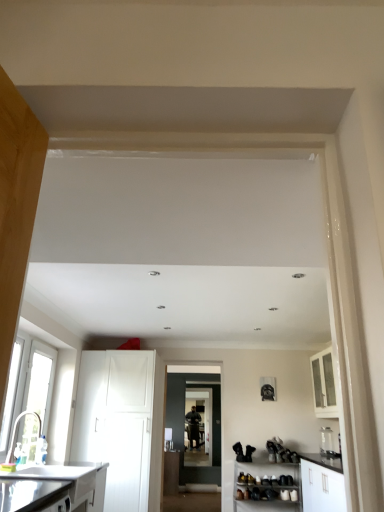
Question: Considering the positions of clear glass jar at lower right and transparent glass door at center in the image, is clear glass jar at lower right taller or shorter than transparent glass door at center?

Choices:
 (A) short
 (B) tall

Answer: (A)

Question: Considering the positions of clear glass jar at lower right and transparent glass door at center in the image, is clear glass jar at lower right wider or thinner than transparent glass door at center?

Choices:
 (A) wide
 (B) thin

Answer: (A)

Question: Which object is positioned farthest from the white glossy countertop at lower left?

Choices:
 (A) white matte cabinet at center, the 5th cabinetry in the front-to-back sequence
 (B) clear glass jar at lower right
 (C) white matte shoe rack at lower right, positioned as the 4th cabinetry in left-to-right order
 (D) brushed metal sink at lower left
 (E) white glass cabinet at right, the first cabinetry when ordered from right to left

Answer: (A)

Question: Considering the real-world distances, which object is farthest from the transparent glass door at center?

Choices:
 (A) clear glass window at left, marked as the 2th window in a back-to-front arrangement
 (B) satin white cabinet at lower left, arranged as the 1th cabinetry when viewed from the front
 (C) white matte cabinet at center, marked as the 1th cabinetry in a back-to-front arrangement
 (D) white glossy countertop at lower left
 (E) white matte cabinet at left, marked as the fourth cabinetry in a back-to-front arrangement

Answer: (A)